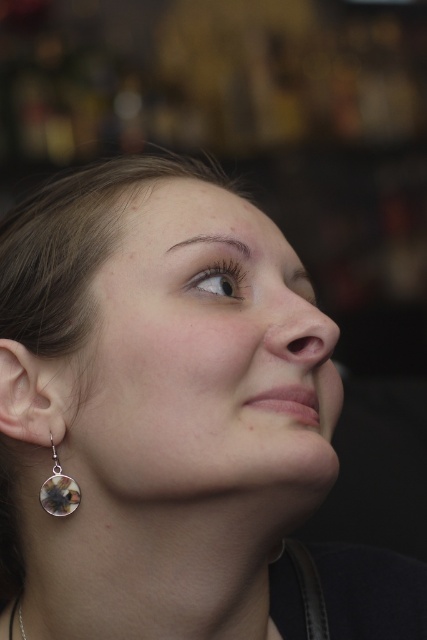
Question: Among these objects, which one is nearest to the camera?

Choices:
 (A) multicolored glass earring at lower left
 (B) brown matte eye at upper right

Answer: (A)

Question: Which of the following is the farthest from the observer?

Choices:
 (A) brown matte eye at upper right
 (B) multicolored glass earring at lower left

Answer: (A)

Question: Does brown matte eye at upper right have a lesser width compared to multicolored glass earring at lower left?

Choices:
 (A) yes
 (B) no

Answer: (B)

Question: Is brown matte eye at upper right bigger than multicolored glass earring at lower left?

Choices:
 (A) no
 (B) yes

Answer: (B)

Question: Is brown matte eye at upper right positioned in front of multicolored glass earring at lower left?

Choices:
 (A) yes
 (B) no

Answer: (B)

Question: Which point is closer to the camera?

Choices:
 (A) (58, 504)
 (B) (196, 291)

Answer: (A)